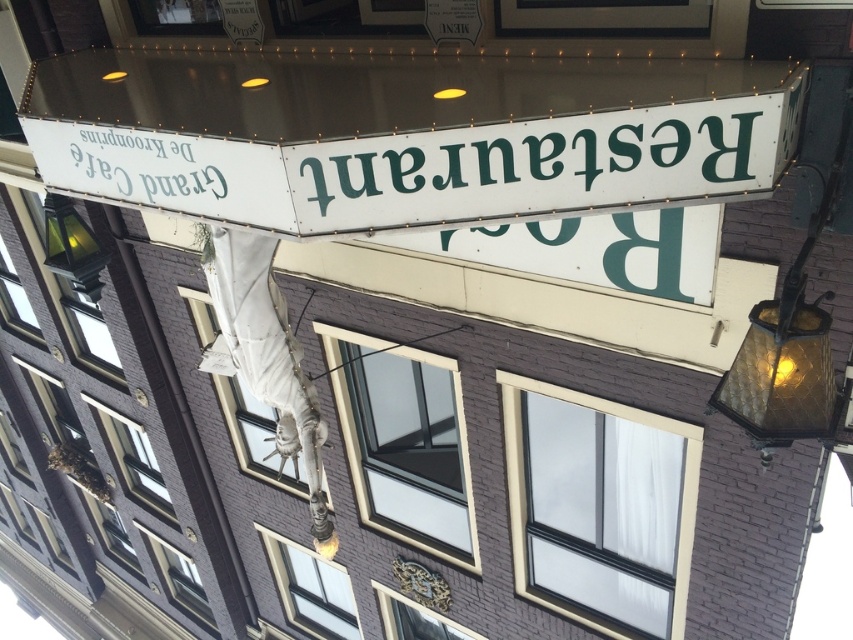
Who is positioned more to the right, white paper sign at upper left or matte glass lamp at left?

white paper sign at upper left

Is point (189, 147) positioned behind point (47, 241)?

No, (189, 147) is closer to viewer.

Where is `white paper sign at upper left`? The image size is (853, 640). white paper sign at upper left is located at coordinates (144, 168).

How distant is greenmaterial/texture sign at upper center from amber glass lamp at right?

greenmaterial/texture sign at upper center and amber glass lamp at right are 28.74 inches apart from each other.

Can you confirm if greenmaterial/texture sign at upper center is taller than amber glass lamp at right?

Incorrect, greenmaterial/texture sign at upper center's height is not larger of amber glass lamp at right's.

Who is more distant from viewer, (341, 180) or (758, 397)?

Positioned behind is point (341, 180).

Find the location of a particular element. greenmaterial/texture sign at upper center is located at coordinates (532, 168).

Which of these two, amber glass lamp at right or white paper sign at upper left, stands taller?

amber glass lamp at right

Who is shorter, amber glass lamp at right or white paper sign at upper left?

Standing shorter between the two is white paper sign at upper left.

Which is behind, point (749, 406) or point (161, 177)?

The point (161, 177) is behind.

Where is `amber glass lamp at right`? amber glass lamp at right is located at coordinates (782, 371).